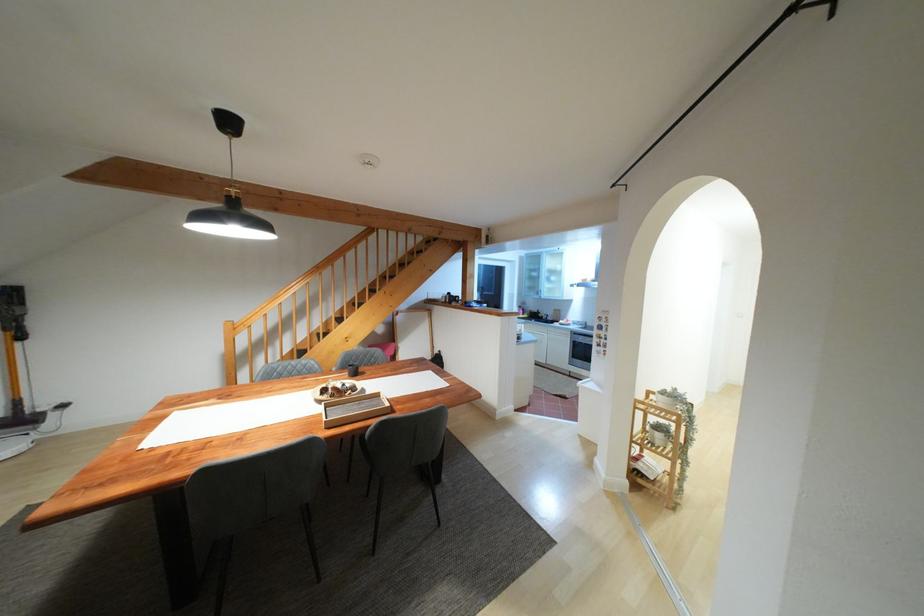
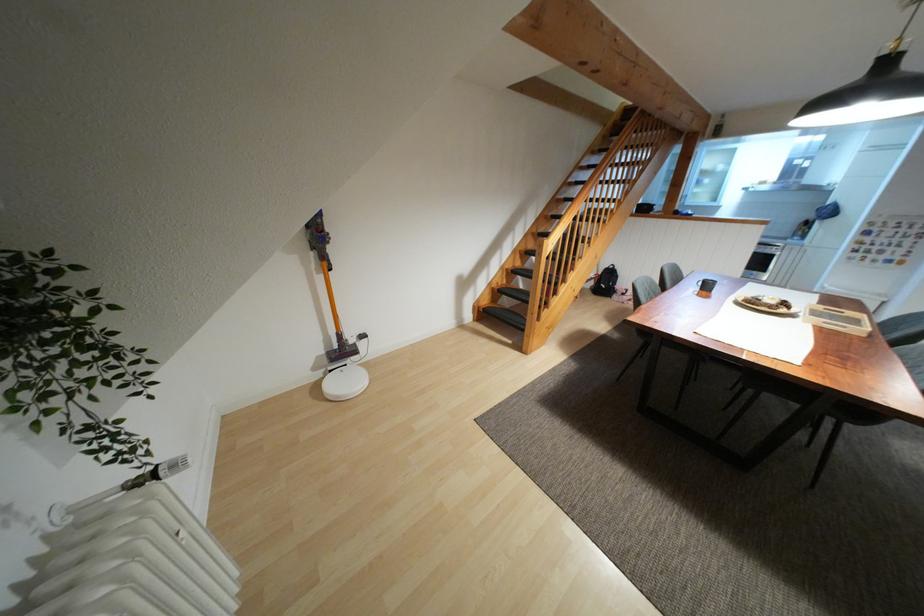
Question: The images are taken continuously from a first-person perspective. In which direction are you moving?

Choices:
 (A) Left
 (B) Right
 (C) Forward
 (D) Backward

Answer: (A)